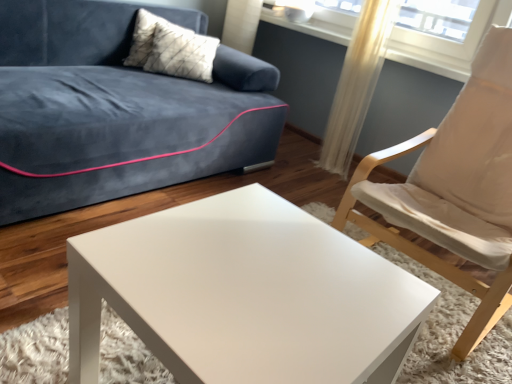
Question: Does translucent fabric curtain at upper right have a smaller size compared to white textured pillow at upper left?

Choices:
 (A) no
 (B) yes

Answer: (B)

Question: Is white textured pillow at upper left completely or partially inside translucent fabric curtain at upper right?

Choices:
 (A) no
 (B) yes

Answer: (A)

Question: From a real-world perspective, is translucent fabric curtain at upper right physically above white textured pillow at upper left?

Choices:
 (A) yes
 (B) no

Answer: (B)

Question: Is translucent fabric curtain at upper right closer to camera compared to white textured pillow at upper left?

Choices:
 (A) yes
 (B) no

Answer: (A)

Question: Is translucent fabric curtain at upper right looking in the opposite direction of white textured pillow at upper left?

Choices:
 (A) no
 (B) yes

Answer: (A)

Question: Is white glossy coffee table at center taller or shorter than translucent fabric curtain at upper right?

Choices:
 (A) tall
 (B) short

Answer: (B)

Question: Is white glossy coffee table at center spatially inside translucent fabric curtain at upper right, or outside of it?

Choices:
 (A) inside
 (B) outside

Answer: (B)

Question: Looking at the image, does white glossy coffee table at center seem bigger or smaller compared to translucent fabric curtain at upper right?

Choices:
 (A) big
 (B) small

Answer: (A)

Question: Considering the positions of white glossy coffee table at center and translucent fabric curtain at upper right in the image, is white glossy coffee table at center wider or thinner than translucent fabric curtain at upper right?

Choices:
 (A) thin
 (B) wide

Answer: (B)

Question: From a real-world perspective, is white glossy coffee table at center above or below white fabric chair at right?

Choices:
 (A) above
 (B) below

Answer: (B)

Question: Considering their positions, is white glossy coffee table at center located in front of or behind white fabric chair at right?

Choices:
 (A) front
 (B) behind

Answer: (A)

Question: Is white glossy coffee table at center wider or thinner than white fabric chair at right?

Choices:
 (A) thin
 (B) wide

Answer: (A)

Question: Is white glossy coffee table at center inside the boundaries of white fabric chair at right, or outside?

Choices:
 (A) inside
 (B) outside

Answer: (B)

Question: From a real-world perspective, is white textured pillow at upper left positioned above or below white glossy coffee table at center?

Choices:
 (A) below
 (B) above

Answer: (B)

Question: From the image's perspective, relative to white glossy coffee table at center, is white textured pillow at upper left above or below?

Choices:
 (A) above
 (B) below

Answer: (A)